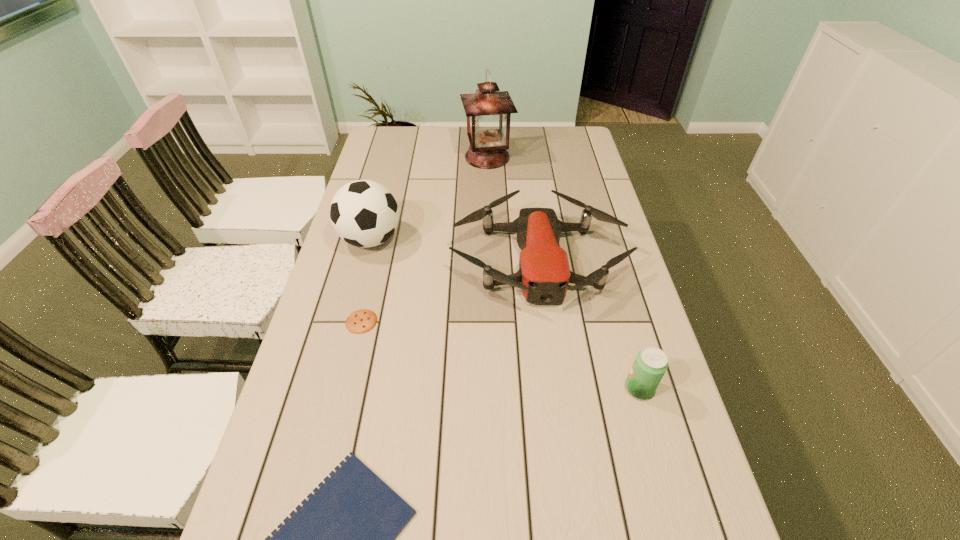
I want to click on vacant position in the image that satisfies the following two spatial constraints: 1. on the front side of the cookie; 2. on the right side of the fifth shortest object, so coord(349,321).

Identify the location of free spot that satisfies the following two spatial constraints: 1. on the front-facing side of the drone; 2. on the left side of the soda. (556, 388).